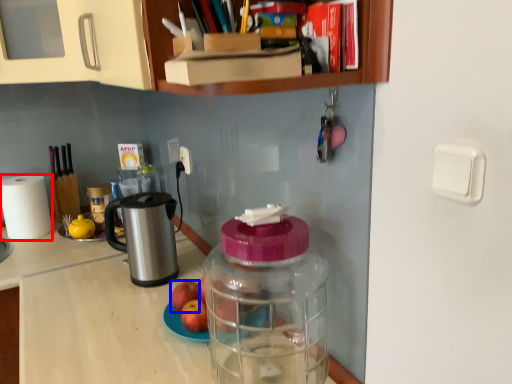
Question: Which object appears farthest to the camera in this image, paper towel (highlighted by a red box) or apple (highlighted by a blue box)?

Choices:
 (A) paper towel
 (B) apple

Answer: (A)